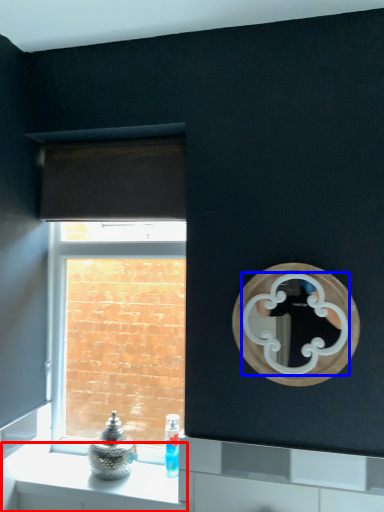
Question: Which point is further to the camera, counter (highlighted by a red box) or mirror (highlighted by a blue box)?

Choices:
 (A) counter
 (B) mirror

Answer: (A)